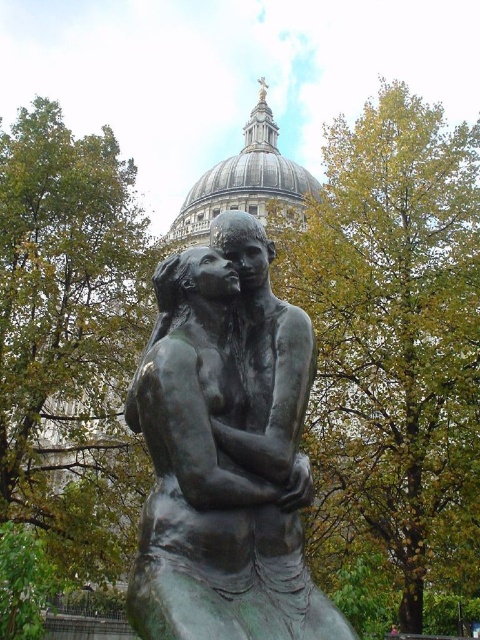
Can you confirm if green leafy tree at center is smaller than green leafy tree at left?

Actually, green leafy tree at center might be larger than green leafy tree at left.

From the picture: Can you confirm if green leafy tree at center is taller than green leafy tree at left?

Correct, green leafy tree at center is much taller as green leafy tree at left.

Is point (362, 150) behind point (119, 422)?

Yes, point (362, 150) is behind point (119, 422).

You are a GUI agent. You are given a task and a screenshot of the screen. Output one action in this format:
    pyautogui.click(x=<x>, y=<y>)
    Task: Click on the green leafy tree at center
    This screenshot has height=640, width=480.
    Given the screenshot: What is the action you would take?
    (x=391, y=330)

Is green leafy tree at center bigger than gray stone dome at upper center?

Yes, green leafy tree at center is bigger than gray stone dome at upper center.

Measure the distance between point (350, 374) and camera.

Point (350, 374) is 64.83 meters from camera.

Which is in front, point (336, 536) or point (315, 188)?

Point (336, 536) is more forward.

The width and height of the screenshot is (480, 640). I want to click on green leafy tree at center, so click(x=391, y=330).

How much distance is there between bronze statue at center and gray stone dome at upper center?

bronze statue at center is 76.80 meters away from gray stone dome at upper center.

Can you confirm if bronze statue at center is thinner than gray stone dome at upper center?

Correct, bronze statue at center's width is less than gray stone dome at upper center's.

At what (x,y) coordinates should I click in order to perform the action: click on bronze statue at center. Please return your answer as a coordinate pair (x, y). This screenshot has height=640, width=480. Looking at the image, I should click on (226, 451).

Find the location of a particular element. Image resolution: width=480 pixels, height=640 pixels. bronze statue at center is located at coordinates (226, 451).